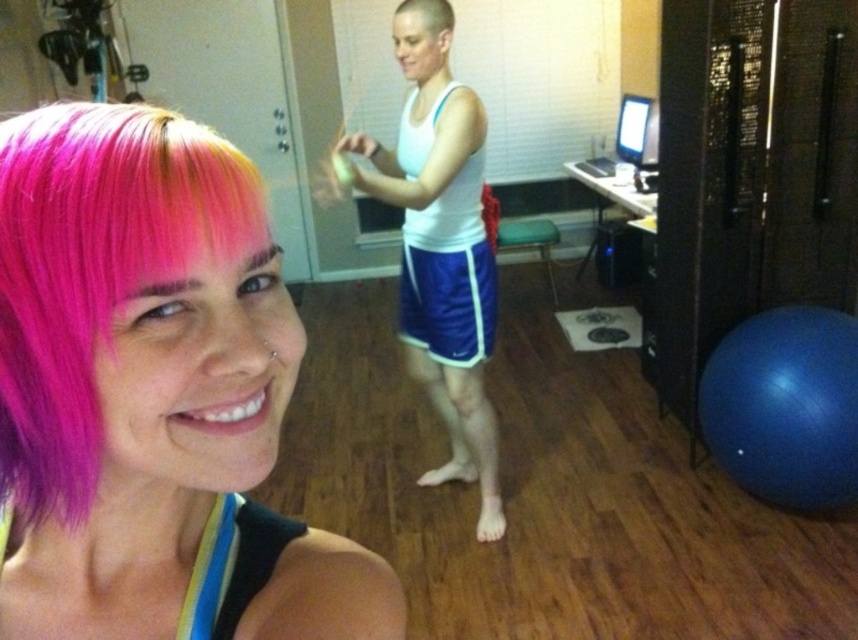
Who is more distant from viewer, [156,138] or [449,292]?

Point [449,292]

Who is positioned more to the left, pink matte hair at center or blue fabric shorts at center?

From the viewer's perspective, pink matte hair at center appears more on the left side.

Is point (58, 304) positioned in front of point (472, 362)?

That is True.

Identify the location of pink matte hair at center. The image size is (858, 640). (152, 396).

Which is below, white matte tank top at center or shiny white hair at center?

white matte tank top at center is lower down.

Is white matte tank top at center to the left of shiny white hair at center from the viewer's perspective?

Correct, you'll find white matte tank top at center to the left of shiny white hair at center.

Where is `white matte tank top at center`? The image size is (858, 640). white matte tank top at center is located at coordinates (440, 253).

Does pink matte hair at center have a smaller size compared to white matte tank top at center?

Indeed, pink matte hair at center has a smaller size compared to white matte tank top at center.

In the scene shown: Between pink matte hair at center and white matte tank top at center, which one appears on the right side from the viewer's perspective?

white matte tank top at center

What do you see at coordinates (152, 396) in the screenshot? I see `pink matte hair at center` at bounding box center [152, 396].

Find the location of a particular element. pink matte hair at center is located at coordinates (152, 396).